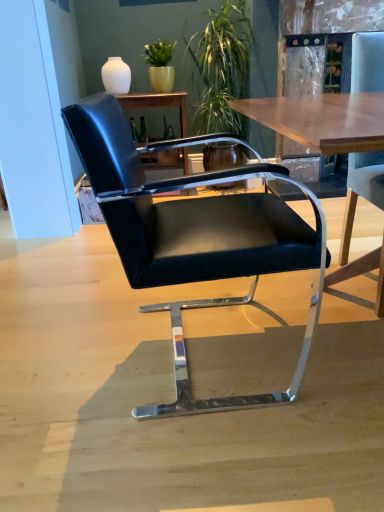
What is the approximate width of green leafy plant at upper center?

It is 22.83 inches.

How much space does black leather chair at right, which appears as the first chair when viewed from the right, occupy horizontally?

22.51 inches.

At what (x,y) coordinates should I click in order to perform the action: click on matte black chair at center. Please return your answer as a coordinate pair (x, y). Looking at the image, I should click on (157, 103).

Identify the location of black leather chair at center, the 1th chair in the left-to-right sequence. The image size is (384, 512). (194, 238).

Is black leather chair at center, the second chair viewed from the right, touching black leather chair at right, the 2th chair when ordered from left to right?

No, black leather chair at center, the second chair viewed from the right, is not with black leather chair at right, the 2th chair when ordered from left to right.

Is black leather chair at center, the 1th chair in the left-to-right sequence, oriented away from black leather chair at right, which appears as the first chair when viewed from the right?

No, black leather chair at right, which appears as the first chair when viewed from the right, is not at the back of black leather chair at center, the 1th chair in the left-to-right sequence.

Considering the points (231, 267) and (357, 268), which point is in front, point (231, 267) or point (357, 268)?

The point (231, 267) is in front.

Is black leather chair at center, the 1th chair in the left-to-right sequence, situated inside black leather chair at right, which appears as the first chair when viewed from the right, or outside?

→ black leather chair at center, the 1th chair in the left-to-right sequence, cannot be found inside black leather chair at right, which appears as the first chair when viewed from the right.

From the image's perspective, is green leafy plant at upper center beneath matte black chair at center?

No, from the image's perspective, green leafy plant at upper center is not beneath matte black chair at center.

Which of these two, green leafy plant at upper center or matte black chair at center, is wider?

Wider between the two is green leafy plant at upper center.

You are a GUI agent. You are given a task and a screenshot of the screen. Output one action in this format:
    pyautogui.click(x=<x>, y=<y>)
    Task: Click on the houseplant located in front of the matte black chair at center
    The width and height of the screenshot is (384, 512).
    Given the screenshot: What is the action you would take?
    pyautogui.click(x=222, y=67)

Between green leafy plant at upper center and matte black chair at center, which one has larger size?

green leafy plant at upper center.

Is green leafy plant at upper center oriented towards black leather chair at right, the 2th chair when ordered from left to right?

Yes, green leafy plant at upper center is aimed at black leather chair at right, the 2th chair when ordered from left to right.

Consider the image. Is green leafy plant at upper center positioned beyond the bounds of black leather chair at right, which appears as the first chair when viewed from the right?

Yes, green leafy plant at upper center is located beyond the bounds of black leather chair at right, which appears as the first chair when viewed from the right.

Can you tell me how much green leafy plant at upper center and black leather chair at right, the 2th chair when ordered from left to right, differ in facing direction?

A: 4.01 degrees separate the facing orientations of green leafy plant at upper center and black leather chair at right, the 2th chair when ordered from left to right.

Which object is positioned more to the left, green leafy plant at upper center or black leather chair at right, which appears as the first chair when viewed from the right?

green leafy plant at upper center is more to the left.

Is black leather chair at right, the 2th chair when ordered from left to right, not near green leafy plant at upper center?

Yes, black leather chair at right, the 2th chair when ordered from left to right, and green leafy plant at upper center are quite far apart.

Based on the photo, from the image's perspective, is black leather chair at right, which appears as the first chair when viewed from the right, on top of green leafy plant at upper center?

No, from the image's perspective, black leather chair at right, which appears as the first chair when viewed from the right, is not over green leafy plant at upper center.

From a real-world perspective, is black leather chair at right, which appears as the first chair when viewed from the right, located higher than green leafy plant at upper center?

Incorrect, from a real-world perspective, black leather chair at right, which appears as the first chair when viewed from the right, is lower than green leafy plant at upper center.

Which is farther from the camera, (371, 42) or (276, 265)?

Positioned behind is point (371, 42).

Considering the relative positions of black leather chair at right, which appears as the first chair when viewed from the right, and black leather chair at center, the 1th chair in the left-to-right sequence, in the image provided, is black leather chair at right, which appears as the first chair when viewed from the right, to the left of black leather chair at center, the 1th chair in the left-to-right sequence, from the viewer's perspective?

No, black leather chair at right, which appears as the first chair when viewed from the right, is not to the left of black leather chair at center, the 1th chair in the left-to-right sequence.

From the image's perspective, is black leather chair at right, the 2th chair when ordered from left to right, above black leather chair at center, the second chair viewed from the right?

Indeed, from the image's perspective, black leather chair at right, the 2th chair when ordered from left to right, is shown above black leather chair at center, the second chair viewed from the right.

Which of these two, black leather chair at right, the 2th chair when ordered from left to right, or black leather chair at center, the second chair viewed from the right, is bigger?

With larger size is black leather chair at center, the second chair viewed from the right.

Is matte black chair at center inside the boundaries of green leafy plant at upper center, or outside?

matte black chair at center is outside green leafy plant at upper center.

Is matte black chair at center turned away from green leafy plant at upper center?

matte black chair at center does not have its back to green leafy plant at upper center.

Based on the photo, is matte black chair at center positioned before green leafy plant at upper center?

No.

From the image's perspective, between matte black chair at center and green leafy plant at upper center, which one is located above?

green leafy plant at upper center is shown above in the image.

Is black leather chair at center, the 1th chair in the left-to-right sequence, not within matte black chair at center?

black leather chair at center, the 1th chair in the left-to-right sequence, lies outside matte black chair at center's area.

Is black leather chair at center, the second chair viewed from the right, not near matte black chair at center?

black leather chair at center, the second chair viewed from the right, is positioned a significant distance from matte black chair at center.

Could you tell me if black leather chair at center, the second chair viewed from the right, is turned towards matte black chair at center?

No.

Where is `chair on the right of black leather chair at center, the 1th chair in the left-to-right sequence`? Image resolution: width=384 pixels, height=512 pixels. chair on the right of black leather chair at center, the 1th chair in the left-to-right sequence is located at coordinates (353, 220).

I want to click on houseplant above the matte black chair at center (from a real-world perspective), so click(222, 67).

Based on their spatial positions, is black leather chair at center, the 1th chair in the left-to-right sequence, or black leather chair at right, which appears as the first chair when viewed from the right, closer to green leafy plant at upper center?

black leather chair at right, which appears as the first chair when viewed from the right, lies closer to green leafy plant at upper center than the other object.

Considering their positions, is black leather chair at center, the 1th chair in the left-to-right sequence, positioned further to black leather chair at right, the 2th chair when ordered from left to right, than green leafy plant at upper center?

green leafy plant at upper center lies further to black leather chair at right, the 2th chair when ordered from left to right, than the other object.

Considering their positions, is black leather chair at right, the 2th chair when ordered from left to right, positioned closer to green leafy plant at upper center than matte black chair at center?

matte black chair at center lies closer to green leafy plant at upper center than the other object.

Which object lies nearer to the anchor point black leather chair at right, which appears as the first chair when viewed from the right, matte black chair at center or green leafy plant at upper center?

green leafy plant at upper center is closer to black leather chair at right, which appears as the first chair when viewed from the right.

From the picture: Looking at the image, which one is located closer to black leather chair at right, the 2th chair when ordered from left to right, matte black chair at center or black leather chair at center, the 1th chair in the left-to-right sequence?

Based on the image, black leather chair at center, the 1th chair in the left-to-right sequence, appears to be nearer to black leather chair at right, the 2th chair when ordered from left to right.

Which object lies further to the anchor point black leather chair at center, the 1th chair in the left-to-right sequence, green leafy plant at upper center or matte black chair at center?

matte black chair at center is further to black leather chair at center, the 1th chair in the left-to-right sequence.

Considering their positions, is black leather chair at center, the second chair viewed from the right, positioned further to matte black chair at center than green leafy plant at upper center?

Based on the image, black leather chair at center, the second chair viewed from the right, appears to be further to matte black chair at center.

Estimate the real-world distances between objects in this image. Which object is closer to green leafy plant at upper center, black leather chair at right, which appears as the first chair when viewed from the right, or black leather chair at center, the 1th chair in the left-to-right sequence?

black leather chair at right, which appears as the first chair when viewed from the right, is positioned closer to the anchor green leafy plant at upper center.

The image size is (384, 512). What are the coordinates of `houseplant between black leather chair at right, which appears as the first chair when viewed from the right, and matte black chair at center, along the z-axis` in the screenshot? It's located at (222, 67).

This screenshot has width=384, height=512. In order to click on chair located between black leather chair at center, the 1th chair in the left-to-right sequence, and green leafy plant at upper center in the depth direction in this screenshot , I will do `click(353, 220)`.

Find the location of a particular element. The image size is (384, 512). houseplant between black leather chair at center, the second chair viewed from the right, and matte black chair at center in the front-back direction is located at coordinates (222, 67).

Identify the location of chair between black leather chair at center, the 1th chair in the left-to-right sequence, and matte black chair at center from front to back. (353, 220).